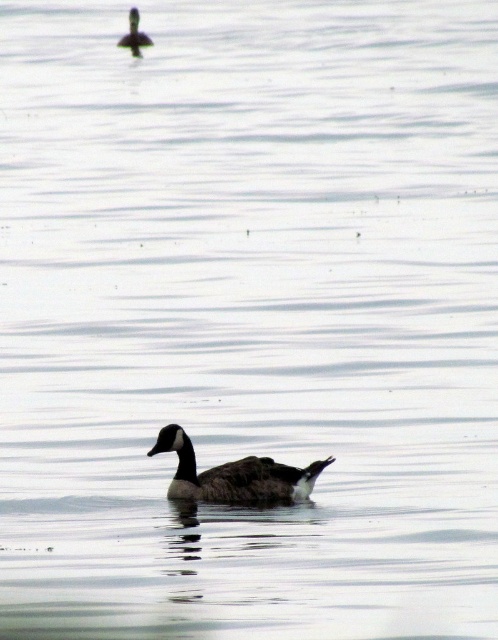
You are a birdwatcher trying to identify ducks in the water. You see a dark brown feathered duck at center and dark brown feathers at upper center. Which one is wider?

The dark brown feathered duck at center is wider than the dark brown feathers at upper center.